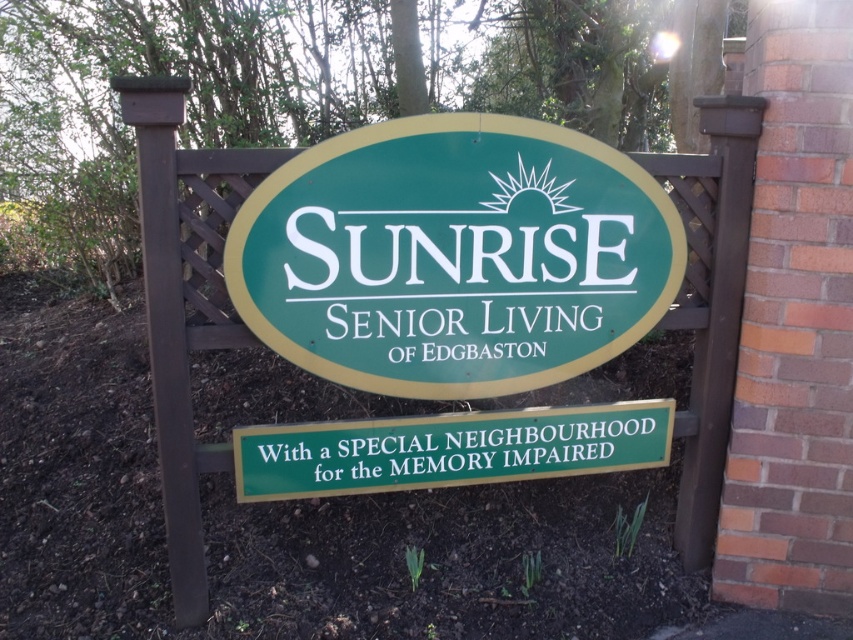
Does green plastic sign at center appear over green matte signboard at center?

Yes.

Who is more forward, (462,323) or (468,412)?

Positioned in front is point (462,323).

Where is `green plastic sign at center`? This screenshot has width=853, height=640. green plastic sign at center is located at coordinates (454, 257).